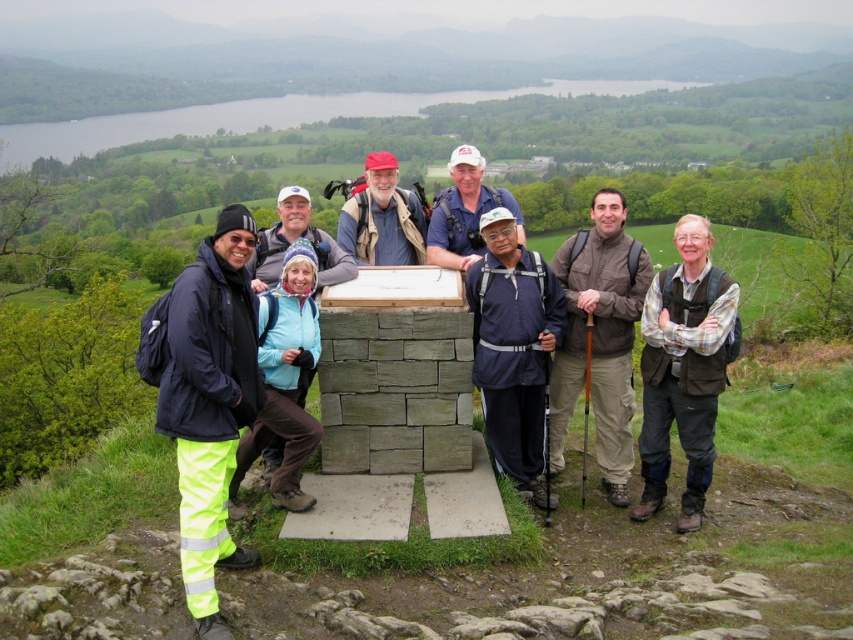
You are part of the hiking group and want to take a photo. You notice the brown fabric jacket at center and the white fabric cap at center. Which one is more to the right in the photo?

The brown fabric jacket at center is positioned on the right side of the white fabric cap at center, so the brown fabric jacket at center is more to the right.

You are part of the hiking group standing in front of the cairn. You notice two points marked on the ground where you want to place your backpacks. The first point is at coordinates point (572,410) and the second at point (392,163). Which point is closer to the cairn?

Point (572,410) is in front of point (392,163), so it is closer to the cairn.